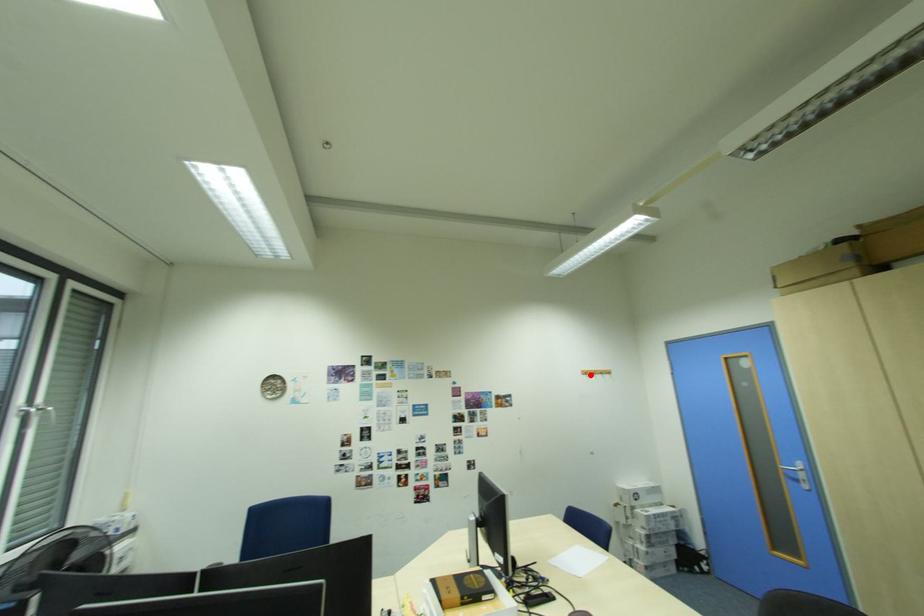
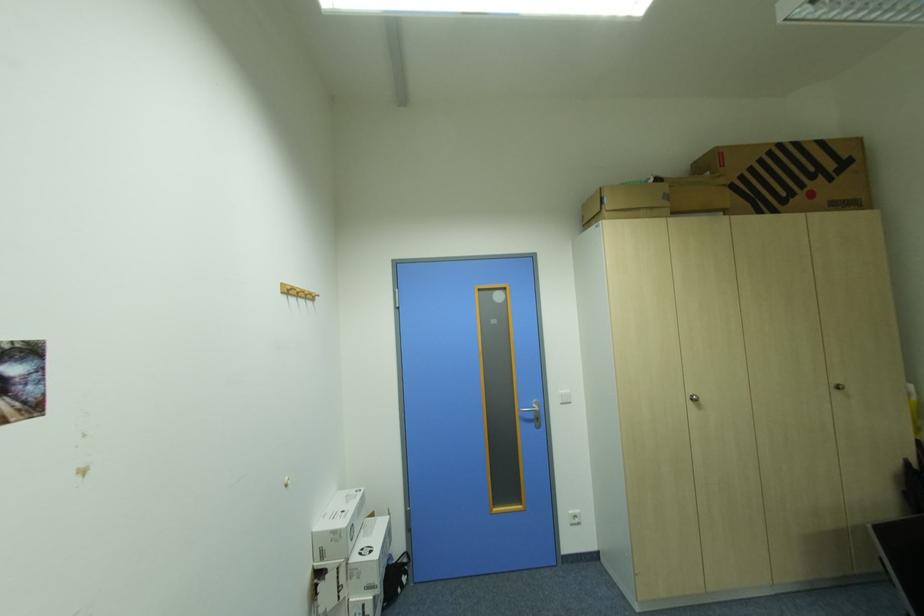
Where in the second image is the point corresponding to the highlighted location from the first image?

(292, 293)